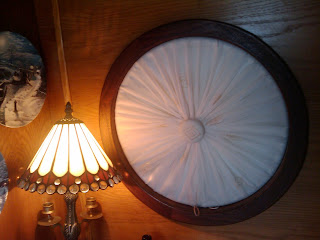
In order to click on candle holders in this screenshot , I will do `click(46, 208)`, `click(91, 203)`.